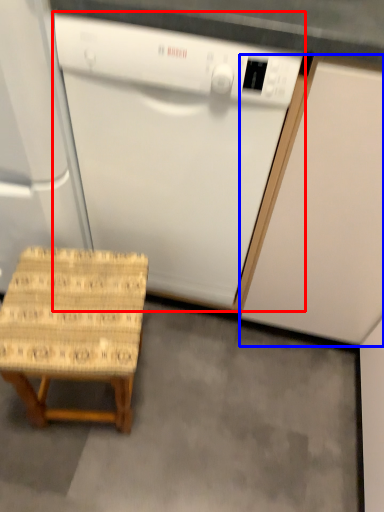
Question: Which object appears farthest to the camera in this image, home appliance (highlighted by a red box) or cabinetry (highlighted by a blue box)?

Choices:
 (A) home appliance
 (B) cabinetry

Answer: (A)